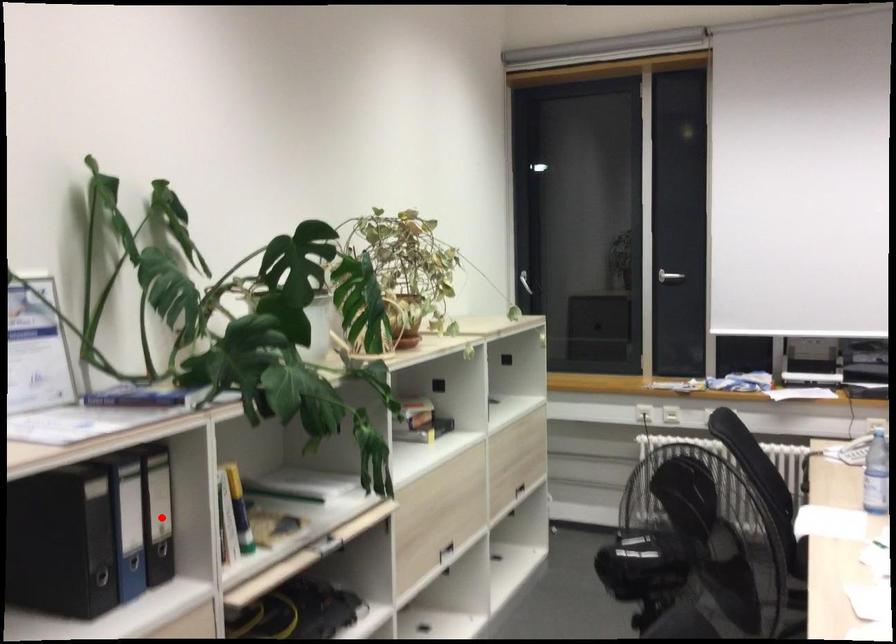
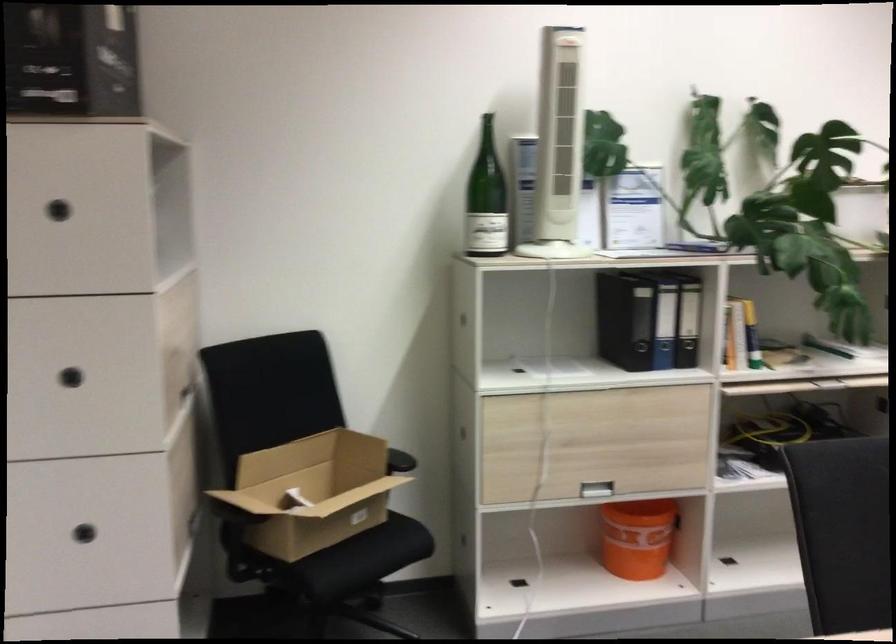
Question: I am providing you with two images of the same scene from different viewpoints. A red point is marked on the first image. At the location where the point appears in image 1, is it still visible in image 2?

Choices:
 (A) Yes
 (B) No

Answer: (A)